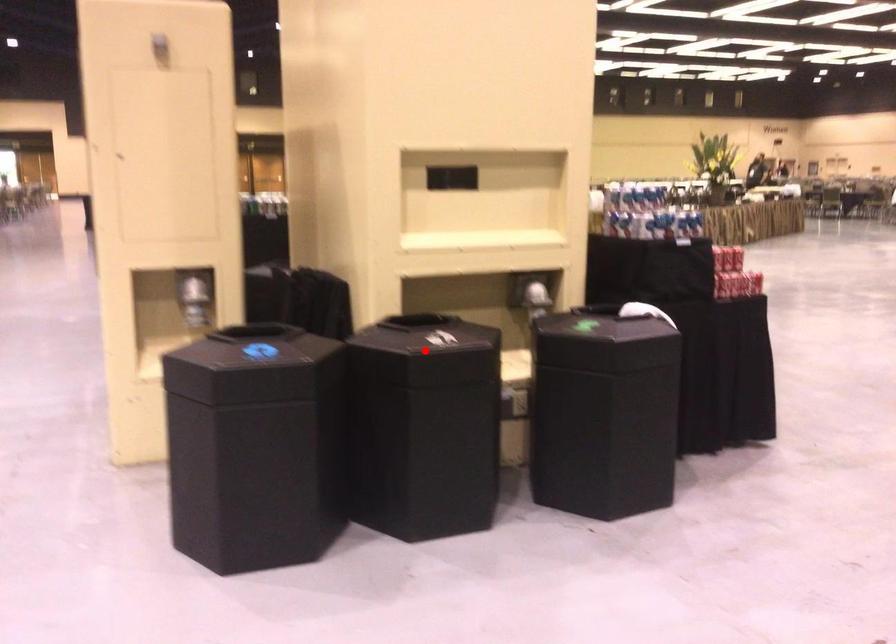
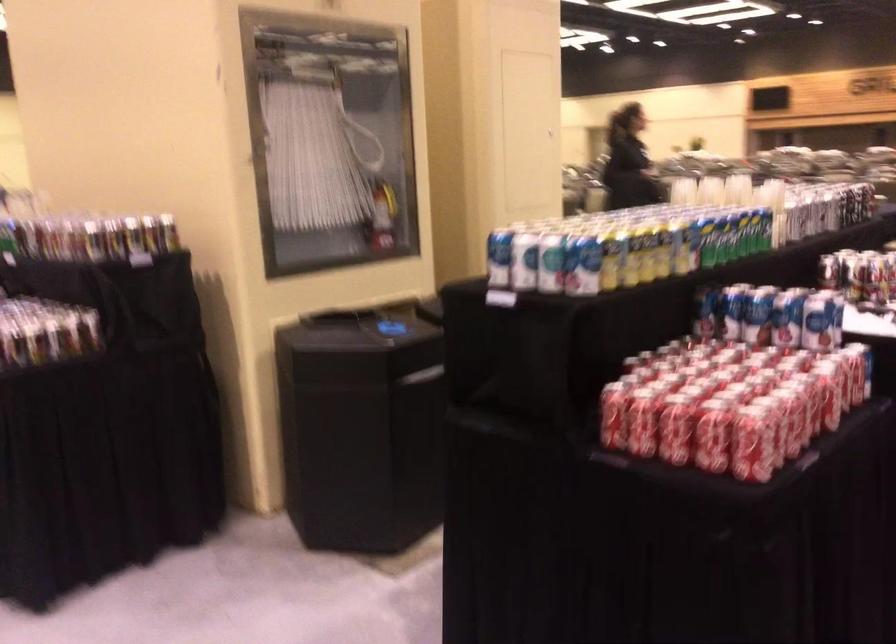
Question: I am providing you with two images of the same scene from different viewpoints. A red point is marked on the first image. Is the red point's position out of view in image 2?

Choices:
 (A) Yes
 (B) No

Answer: (A)